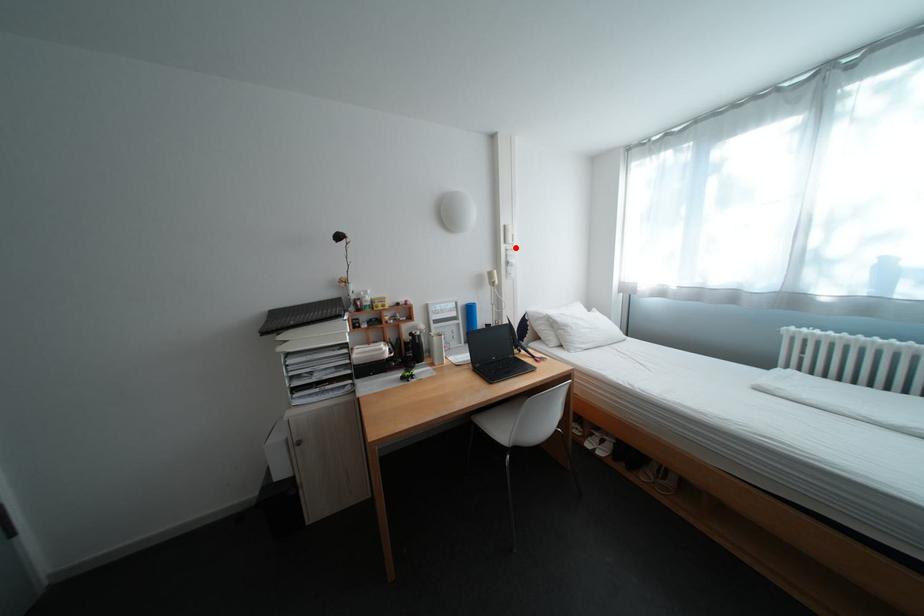
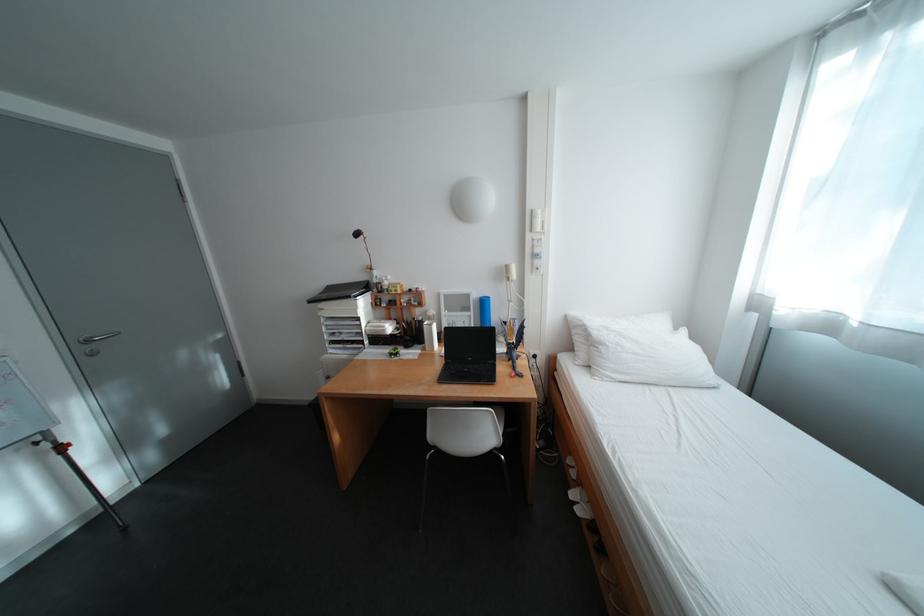
The point at the highlighted location is marked in the first image. Where is the corresponding point in the second image?

(541, 237)